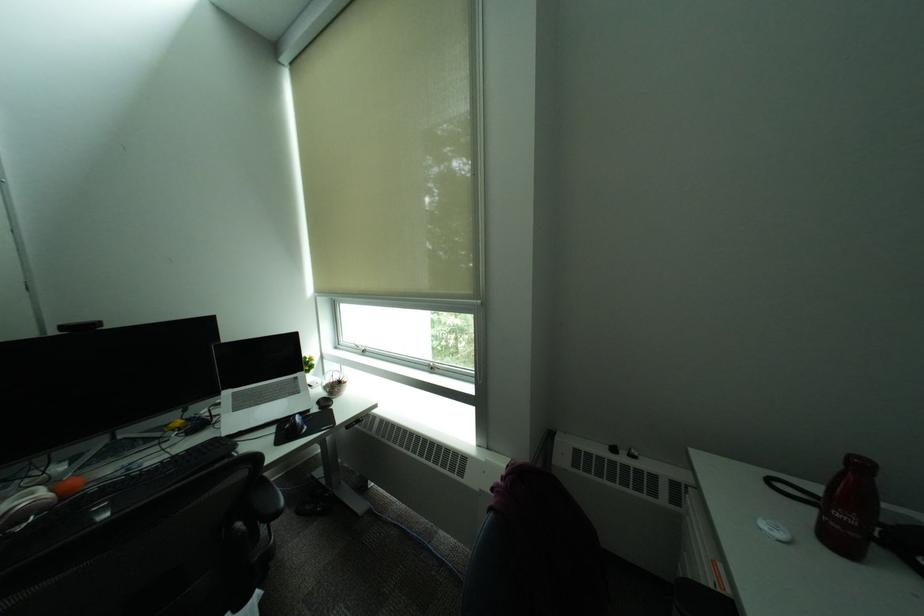
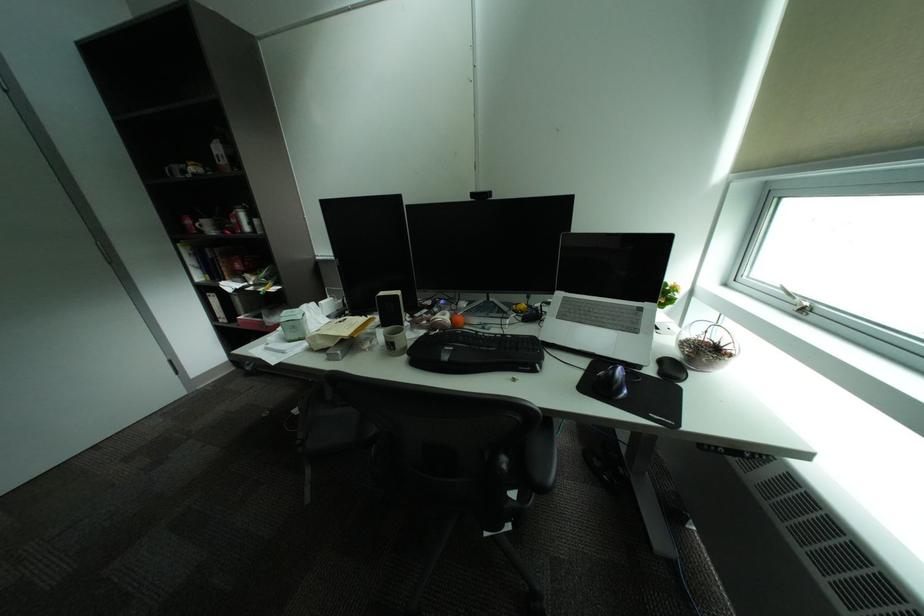
In the second image, find the point that corresponds to point 372,353 in the first image.

(808, 310)